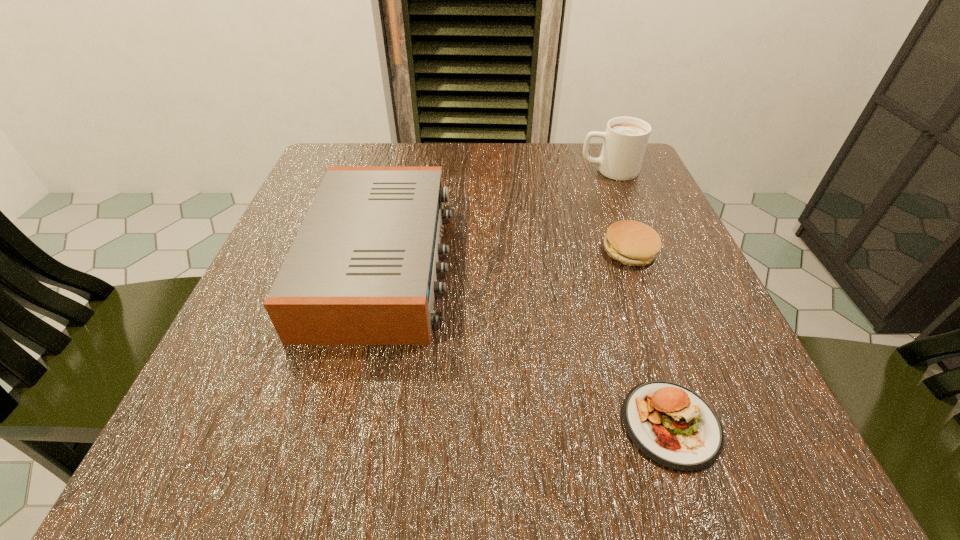
The width and height of the screenshot is (960, 540). What are the coordinates of `vacant area situated 0.270m on the side with the handle of the cappuccino` in the screenshot? It's located at (458, 171).

What are the coordinates of `blank space located 0.170m on the front panel of the third shortest object` in the screenshot? It's located at (547, 263).

Where is `free point located 0.310m on the back of the taller patty (food)`? The height and width of the screenshot is (540, 960). free point located 0.310m on the back of the taller patty (food) is located at coordinates (593, 152).

Find the location of a particular element. The image size is (960, 540). vacant space located on the left of the nearer patty (food) is located at coordinates tap(437, 424).

What are the coordinates of `object that is at the far edge` in the screenshot? It's located at (625, 139).

Identify the location of object that is positioned at the near edge. This screenshot has height=540, width=960. (669, 423).

You are a GUI agent. You are given a task and a screenshot of the screen. Output one action in this format:
    pyautogui.click(x=<x>, y=<y>)
    Task: Click on the object present at the left edge
    
    Given the screenshot: What is the action you would take?
    pyautogui.click(x=362, y=269)

Where is `cappuccino located at the right edge`? This screenshot has height=540, width=960. cappuccino located at the right edge is located at coordinates (625, 139).

Find the location of a particular element. The height and width of the screenshot is (540, 960). object at the far right corner is located at coordinates (625, 139).

Where is `object located at the near right corner`? This screenshot has width=960, height=540. object located at the near right corner is located at coordinates click(669, 423).